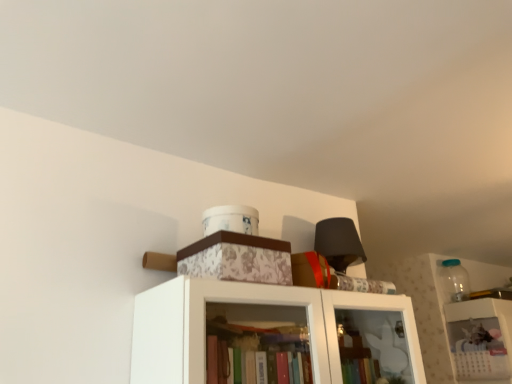
What do you see at coordinates (481, 339) in the screenshot? I see `white paper calendar at upper right` at bounding box center [481, 339].

The image size is (512, 384). I want to click on white paper calendar at upper right, so (481, 339).

Does white paper calendar at upper right have a smaller size compared to floral-patterned cardboard box at upper center?

Actually, white paper calendar at upper right might be larger than floral-patterned cardboard box at upper center.

Is white paper calendar at upper right to the left or to the right of floral-patterned cardboard box at upper center in the image?

white paper calendar at upper right is to the right of floral-patterned cardboard box at upper center.

At what (x,y) coordinates should I click in order to perform the action: click on shelf on the right of floral-patterned cardboard box at upper center. Please return your answer as a coordinate pair (x, y). The width and height of the screenshot is (512, 384). Looking at the image, I should click on (481, 339).

Does white paper calendar at upper right touch floral-patterned cardboard box at upper center?

There is a gap between white paper calendar at upper right and floral-patterned cardboard box at upper center.

Based on their sizes in the image, would you say transparent glass jar at upper right is bigger or smaller than floral-patterned cardboard box at upper center?

transparent glass jar at upper right is smaller than floral-patterned cardboard box at upper center.

Can you confirm if transparent glass jar at upper right is wider than floral-patterned cardboard box at upper center?

In fact, transparent glass jar at upper right might be narrower than floral-patterned cardboard box at upper center.

How distant is transparent glass jar at upper right from floral-patterned cardboard box at upper center?

7.08 feet.

Is the position of transparent glass jar at upper right more distant than that of floral-patterned cardboard box at upper center?

Yes, the depth of transparent glass jar at upper right is greater than that of floral-patterned cardboard box at upper center.

Considering their positions, is transparent glass jar at upper right located in front of or behind white paper calendar at upper right?

In the image, transparent glass jar at upper right appears behind white paper calendar at upper right.

From a real-world perspective, is transparent glass jar at upper right positioned under white paper calendar at upper right based on gravity?

No, from a real-world perspective, transparent glass jar at upper right is not below white paper calendar at upper right.

Which point is more forward, (452, 291) or (477, 375)?

Point (477, 375)

Is white paper calendar at upper right further to the viewer compared to transparent glass jar at upper right?

That is False.

Is white paper calendar at upper right not near transparent glass jar at upper right?

No, there isn't a large distance between white paper calendar at upper right and transparent glass jar at upper right.

Looking at the image, does white paper calendar at upper right seem bigger or smaller compared to transparent glass jar at upper right?

Clearly, white paper calendar at upper right is larger in size than transparent glass jar at upper right.

From the image's perspective, does floral-patterned cardboard box at upper center appear higher than transparent glass jar at upper right?

Yes, from the image's perspective, floral-patterned cardboard box at upper center is on top of transparent glass jar at upper right.

Between point (238, 260) and point (452, 259), which one is positioned behind?

Positioned behind is point (452, 259).

Does floral-patterned cardboard box at upper center have a smaller size compared to transparent glass jar at upper right?

Incorrect, floral-patterned cardboard box at upper center is not smaller in size than transparent glass jar at upper right.

From their relative heights in the image, would you say floral-patterned cardboard box at upper center is taller or shorter than transparent glass jar at upper right?

Considering their sizes, floral-patterned cardboard box at upper center has less height than transparent glass jar at upper right.

Is the depth of floral-patterned cardboard box at upper center greater than that of white paper calendar at upper right?

No, the depth of floral-patterned cardboard box at upper center is less than that of white paper calendar at upper right.

How different are the orientations of floral-patterned cardboard box at upper center and white paper calendar at upper right in degrees?

There is a 2.64-degree angle between the facing directions of floral-patterned cardboard box at upper center and white paper calendar at upper right.

Could you tell me if floral-patterned cardboard box at upper center is facing white paper calendar at upper right?

No.

Which is farther from the camera, [253,262] or [451,338]?

The point [451,338] is farther from the camera.

Where is `shelf lying on the right of floral-patterned cardboard box at upper center`? shelf lying on the right of floral-patterned cardboard box at upper center is located at coordinates (481, 339).

Image resolution: width=512 pixels, height=384 pixels. Identify the location of bottle above the floral-patterned cardboard box at upper center (from a real-world perspective). (454, 280).

Based on their spatial positions, is white paper calendar at upper right or transparent glass jar at upper right further from floral-patterned cardboard box at upper center?

transparent glass jar at upper right lies further to floral-patterned cardboard box at upper center than the other object.

Estimate the real-world distances between objects in this image. Which object is closer to transparent glass jar at upper right, white paper calendar at upper right or floral-patterned cardboard box at upper center?

white paper calendar at upper right.

Looking at the image, which one is located further to transparent glass jar at upper right, floral-patterned cardboard box at upper center or white paper calendar at upper right?

The object further to transparent glass jar at upper right is floral-patterned cardboard box at upper center.

Considering their positions, is floral-patterned cardboard box at upper center positioned closer to white paper calendar at upper right than transparent glass jar at upper right?

The object closer to white paper calendar at upper right is transparent glass jar at upper right.

Estimate the real-world distances between objects in this image. Which object is further from floral-patterned cardboard box at upper center, transparent glass jar at upper right or white paper calendar at upper right?

Among the two, transparent glass jar at upper right is located further to floral-patterned cardboard box at upper center.

Consider the image. Which object lies further to the anchor point white paper calendar at upper right, transparent glass jar at upper right or floral-patterned cardboard box at upper center?

Based on the image, floral-patterned cardboard box at upper center appears to be further to white paper calendar at upper right.

Identify the location of bottle between floral-patterned cardboard box at upper center and white paper calendar at upper right in the horizontal direction. The width and height of the screenshot is (512, 384). (454, 280).